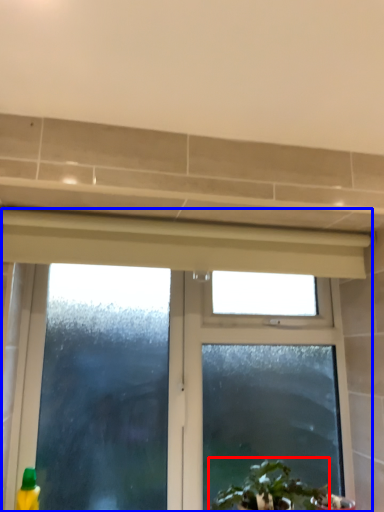
Question: Which of the following is the closest to the observer, houseplant (highlighted by a red box) or window (highlighted by a blue box)?

Choices:
 (A) houseplant
 (B) window

Answer: (A)